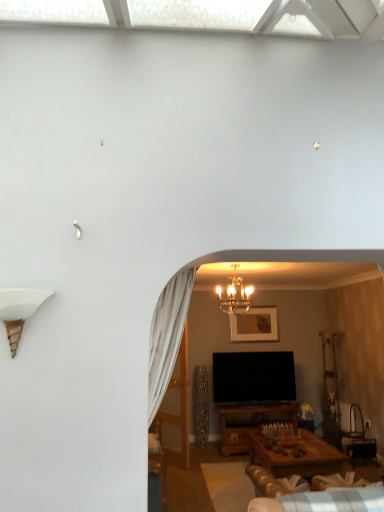
Question: Does gold metallic chandelier at center have a greater height compared to plush beige couch at lower center?

Choices:
 (A) yes
 (B) no

Answer: (A)

Question: Is gold metallic chandelier at center in contact with plush beige couch at lower center?

Choices:
 (A) no
 (B) yes

Answer: (A)

Question: Is gold metallic chandelier at center far from plush beige couch at lower center?

Choices:
 (A) no
 (B) yes

Answer: (B)

Question: Can you confirm if gold metallic chandelier at center is bigger than plush beige couch at lower center?

Choices:
 (A) no
 (B) yes

Answer: (A)

Question: From the image's perspective, is gold metallic chandelier at center located above plush beige couch at lower center?

Choices:
 (A) yes
 (B) no

Answer: (A)

Question: Would you say gold metallic chandelier at center is outside plush beige couch at lower center?

Choices:
 (A) yes
 (B) no

Answer: (A)

Question: Would you say gold metallic chandelier at center is part of translucent glass door at center's contents?

Choices:
 (A) yes
 (B) no

Answer: (B)

Question: Is translucent glass door at center facing towards gold metallic chandelier at center?

Choices:
 (A) no
 (B) yes

Answer: (A)

Question: Are translucent glass door at center and gold metallic chandelier at center located far from each other?

Choices:
 (A) yes
 (B) no

Answer: (A)

Question: Considering the relative positions of translucent glass door at center and gold metallic chandelier at center in the image provided, is translucent glass door at center in front of gold metallic chandelier at center?

Choices:
 (A) no
 (B) yes

Answer: (A)

Question: Is translucent glass door at center further to the viewer compared to gold metallic chandelier at center?

Choices:
 (A) no
 (B) yes

Answer: (B)

Question: From the image's perspective, is translucent glass door at center on top of gold metallic chandelier at center?

Choices:
 (A) no
 (B) yes

Answer: (A)

Question: From the image's perspective, does plush beige couch at lower center appear lower than gold metallic chandelier at center?

Choices:
 (A) yes
 (B) no

Answer: (A)